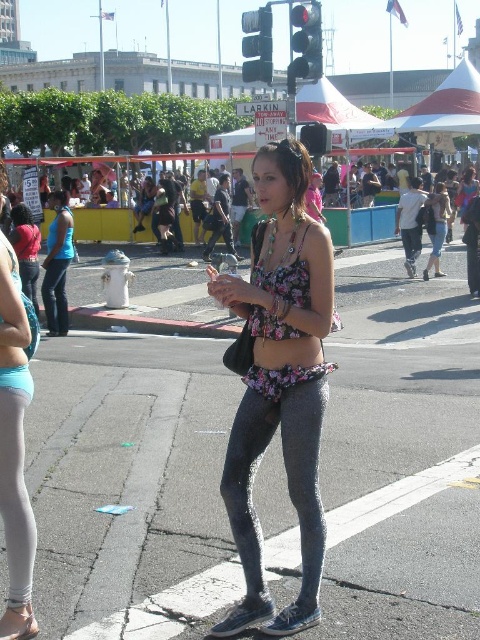
Question: Does matte blue tank top at left have a smaller size compared to denim at left?

Choices:
 (A) yes
 (B) no

Answer: (B)

Question: Can you confirm if black plastic traffic light at upper center is smaller than metallic traffic light at upper center?

Choices:
 (A) no
 (B) yes

Answer: (A)

Question: Which object appears closest to the camera in this image?

Choices:
 (A) denim at left
 (B) matte blue leggings at center

Answer: (B)

Question: Where is gray textured leggings at center located in relation to black plastic traffic light at upper center in the image?

Choices:
 (A) above
 (B) below

Answer: (B)

Question: Among these points, which one is farthest from the camera?

Choices:
 (A) click(x=48, y=284)
 (B) click(x=23, y=616)
 (C) click(x=315, y=458)
 (D) click(x=10, y=384)

Answer: (A)

Question: Which of the following is the farthest from the observer?

Choices:
 (A) (x=31, y=244)
 (B) (x=268, y=433)

Answer: (A)